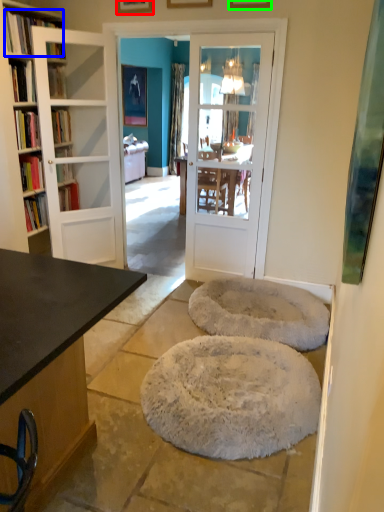
Question: Which object is the farthest from picture frame (highlighted by a red box)? Choose among these: book (highlighted by a blue box) or picture frame (highlighted by a green box).

Choices:
 (A) book
 (B) picture frame

Answer: (B)